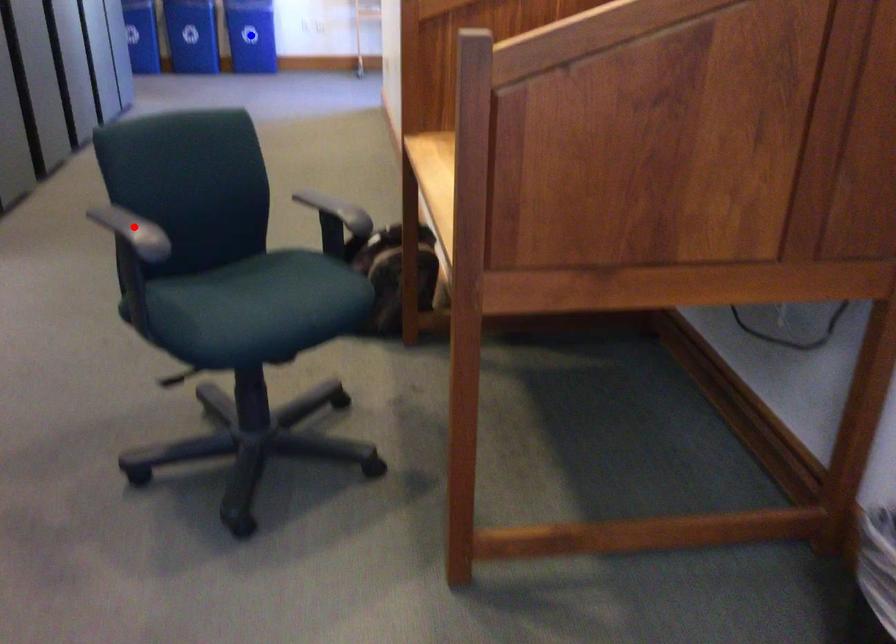
Question: Which of the two points in the image is closer to the camera?

Choices:
 (A) Blue point is closer.
 (B) Red point is closer.

Answer: (B)